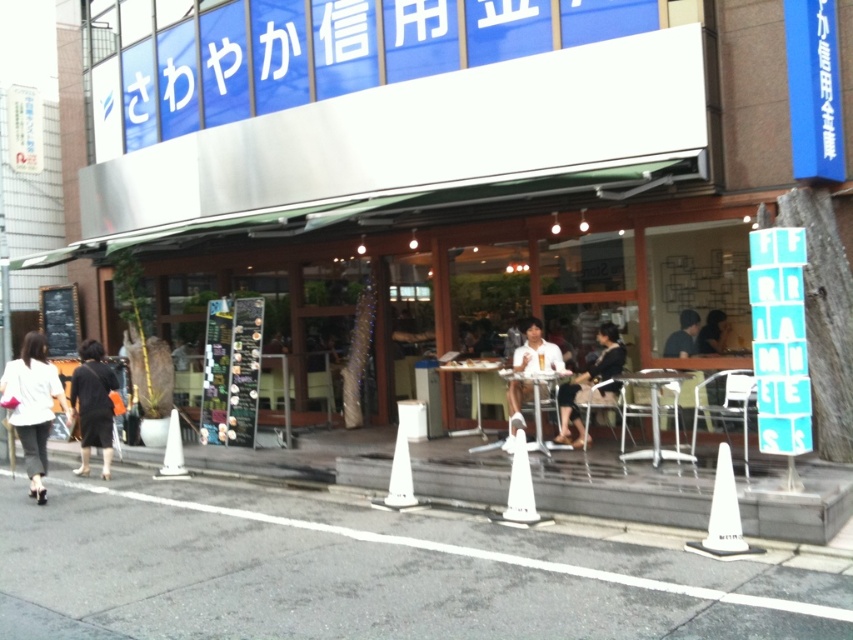
You are standing at the entrance of the cafe and see two points marked on the ground. The first point is at coordinate point (618, 371) and the second is at point (654, 433). Which point is closer to the entrance?

Point (654, 433) is closer to the entrance because it is in front of point (618, 371), which is behind it.

You are a delivery person approaching the cafe and need to park your bike. The bike requires 3 meters of space to park. There is a white plastic traffic cone at lower right and a camera somewhere. Can you park your bike between them?

The distance between the white plastic traffic cone at lower right and the camera is 5.65 meters, which is more than enough space to park the bike requiring 3 meters. Yes, you can park your bike between them.